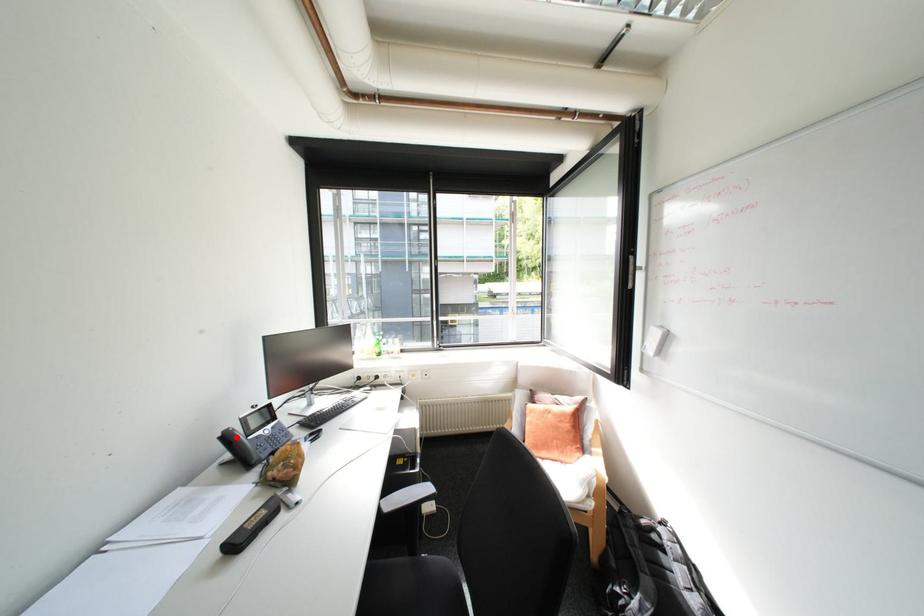
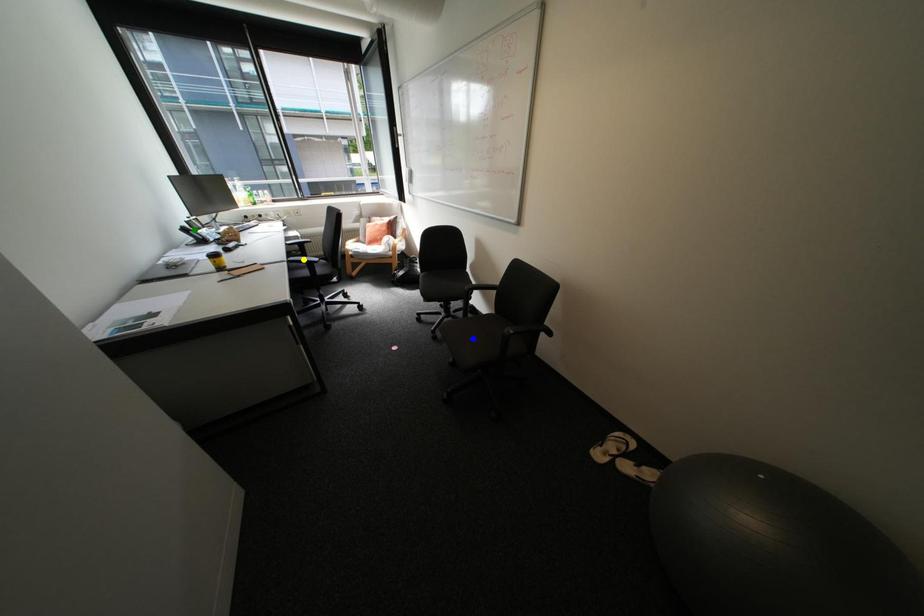
Question: I am providing you with two images of the same scene from different viewpoints. A red point is marked on the first image. You are given multiple points on the second image. In image 2, which mark is for the same physical point as the one in image 1?

Choices:
 (A) blue point
 (B) yellow point
 (C) green point

Answer: (C)